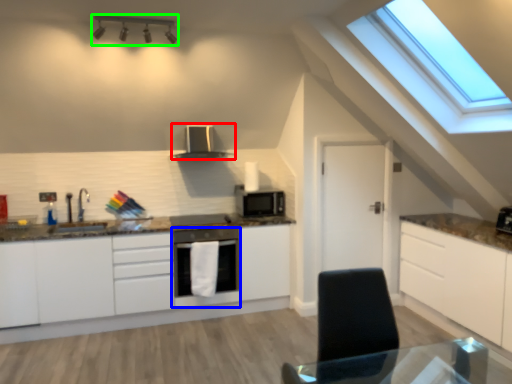
Question: Which is nearer to the kitchen appliance (highlighted by a red box)? home appliance (highlighted by a blue box) or light fixture (highlighted by a green box).

Choices:
 (A) home appliance
 (B) light fixture

Answer: (A)